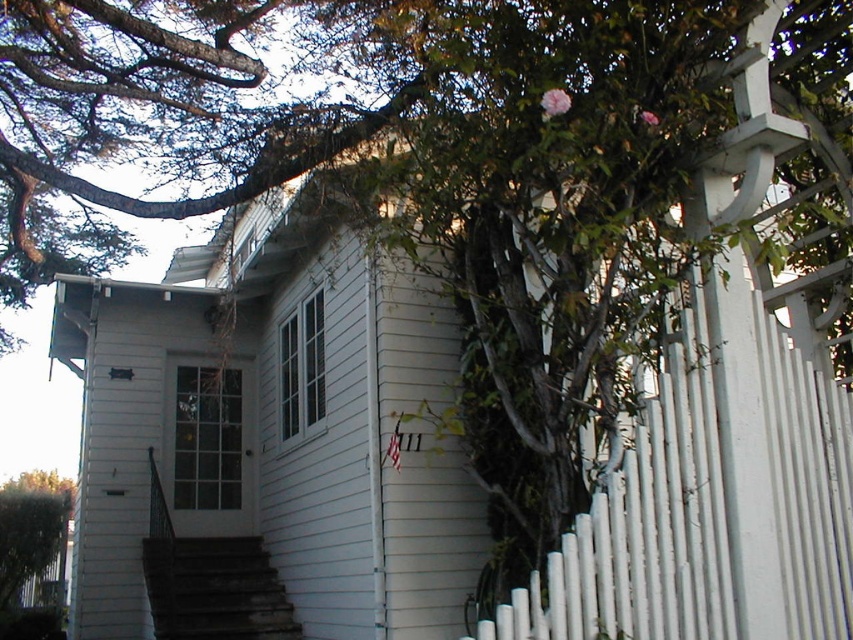
You are a delivery person trying to deliver a package to the house. You see the dark gray concrete stairs at lower center and the green leafy tree at lower left. Which object is closer to the ground?

The dark gray concrete stairs at lower center is shorter than the green leafy tree at lower left, so the stairs are closer to the ground.

You are a delivery person trying to park your van in front of the house. The van requires a space wider than the green leafy tree at lower left. Can the dark gray concrete stairs at lower center provide enough width for parking?

The dark gray concrete stairs at lower center might be wider than green leafy tree at lower left, so it could potentially provide sufficient width for parking the van.